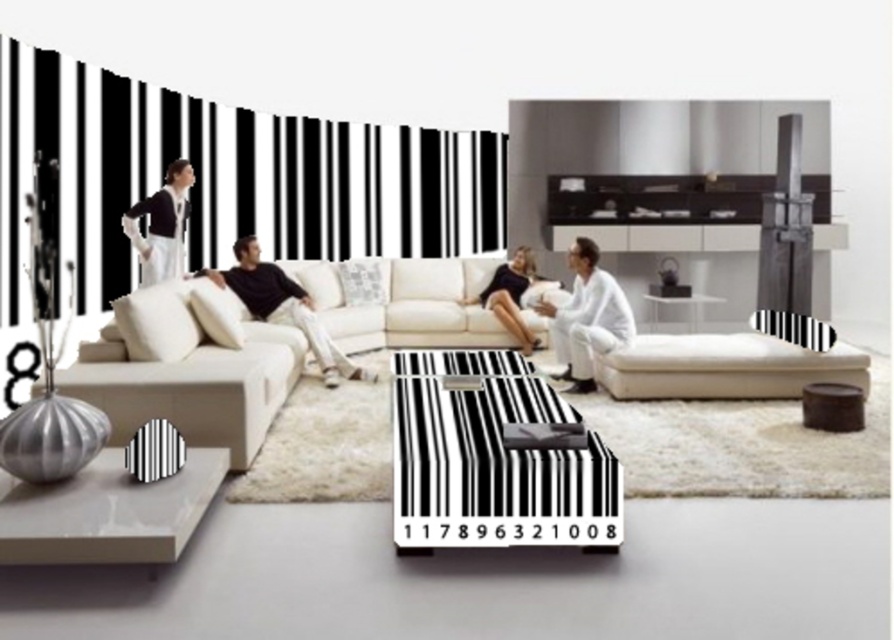
What do you see at coordinates (192, 385) in the screenshot? I see `white leather couch at center` at bounding box center [192, 385].

Can you confirm if white leather couch at center is shorter than beige fabric sofa at center?

In fact, white leather couch at center may be taller than beige fabric sofa at center.

In the scene shown: Who is more distant from viewer, [180,371] or [677,362]?

Point [677,362]

The image size is (894, 640). Identify the location of white leather couch at center. (192, 385).

Is matte black dress at upper left to the left of matte black dress at center from the viewer's perspective?

Correct, you'll find matte black dress at upper left to the left of matte black dress at center.

Is matte black dress at upper left further to the viewer compared to matte black dress at center?

No.

Locate an element on the screen. The image size is (894, 640). matte black dress at upper left is located at coordinates (161, 225).

I want to click on matte black dress at upper left, so click(x=161, y=225).

Is black glossy coffee table at center to the left of matte white coffee table at lower left from the viewer's perspective?

No, black glossy coffee table at center is not to the left of matte white coffee table at lower left.

Is point (551, 540) positioned behind point (104, 461)?

No, it is not.

Is point (419, 384) in front of point (15, 513)?

No, it is behind (15, 513).

At what (x,y) coordinates should I click in order to perform the action: click on black glossy coffee table at center. Please return your answer as a coordinate pair (x, y). The width and height of the screenshot is (894, 640). Looking at the image, I should click on (494, 458).